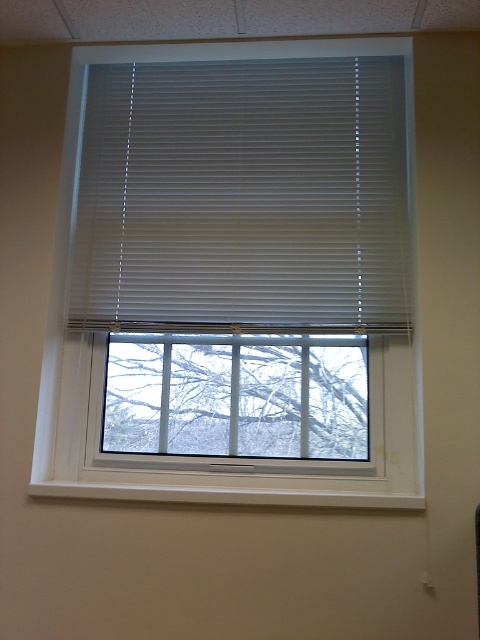
Question: Which object appears closest to the camera in this image?

Choices:
 (A) clear glass window at center
 (B) white matte blinds at center

Answer: (B)

Question: Can you confirm if white matte blinds at center is positioned to the right of clear glass window at center?

Choices:
 (A) yes
 (B) no

Answer: (A)

Question: Is white matte blinds at center positioned before clear glass window at center?

Choices:
 (A) no
 (B) yes

Answer: (B)

Question: Can you confirm if white matte blinds at center is positioned below clear glass window at center?

Choices:
 (A) yes
 (B) no

Answer: (B)